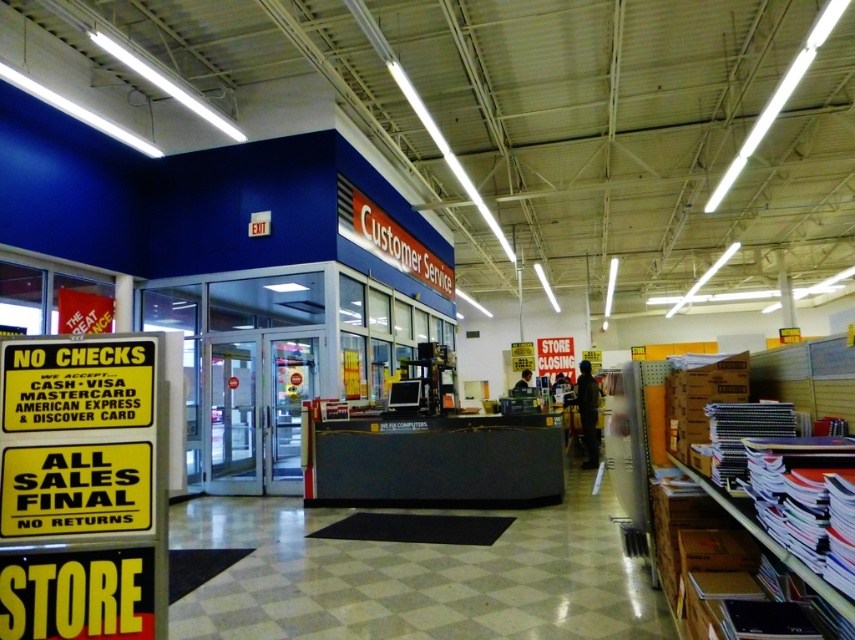
Is point (824, 385) less distant than point (582, 394)?

Yes, point (824, 385) is closer to viewer.

Can you confirm if stacked paper at right is positioned to the left of dark clothing figure at center?

Correct, you'll find stacked paper at right to the left of dark clothing figure at center.

Is point (820, 484) farther from camera compared to point (581, 388)?

No, (820, 484) is in front of (581, 388).

Find the location of a particular element. stacked paper at right is located at coordinates (771, 538).